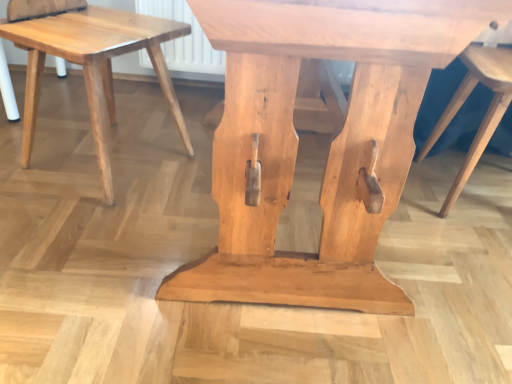
Question: In terms of height, does natural wood stool at center, the 1th stool in the right-to-left sequence, look taller or shorter compared to natural wood stool at lower left, arranged as the first stool when viewed from the left?

Choices:
 (A) tall
 (B) short

Answer: (A)

Question: From a real-world perspective, relative to natural wood stool at lower left, arranged as the first stool when viewed from the left, is natural wood stool at center, acting as the 2th stool starting from the left, vertically above or below?

Choices:
 (A) below
 (B) above

Answer: (B)

Question: Looking at the image, does natural wood stool at center, the 1th stool in the right-to-left sequence, seem bigger or smaller compared to natural wood stool at lower left, the 2th stool positioned from the right?

Choices:
 (A) small
 (B) big

Answer: (B)

Question: In terms of width, does natural wood stool at lower left, the 2th stool positioned from the right, look wider or thinner when compared to natural wood stool at center, acting as the 2th stool starting from the left?

Choices:
 (A) wide
 (B) thin

Answer: (A)

Question: Does point (87, 72) appear closer or farther from the camera than point (494, 110)?

Choices:
 (A) farther
 (B) closer

Answer: (B)

Question: From a real-world perspective, relative to natural wood stool at center, acting as the 2th stool starting from the left, is natural wood stool at lower left, the 2th stool positioned from the right, vertically above or below?

Choices:
 (A) below
 (B) above

Answer: (A)

Question: From the image's perspective, is natural wood stool at lower left, arranged as the first stool when viewed from the left, positioned above or below natural wood stool at center, acting as the 2th stool starting from the left?

Choices:
 (A) above
 (B) below

Answer: (A)